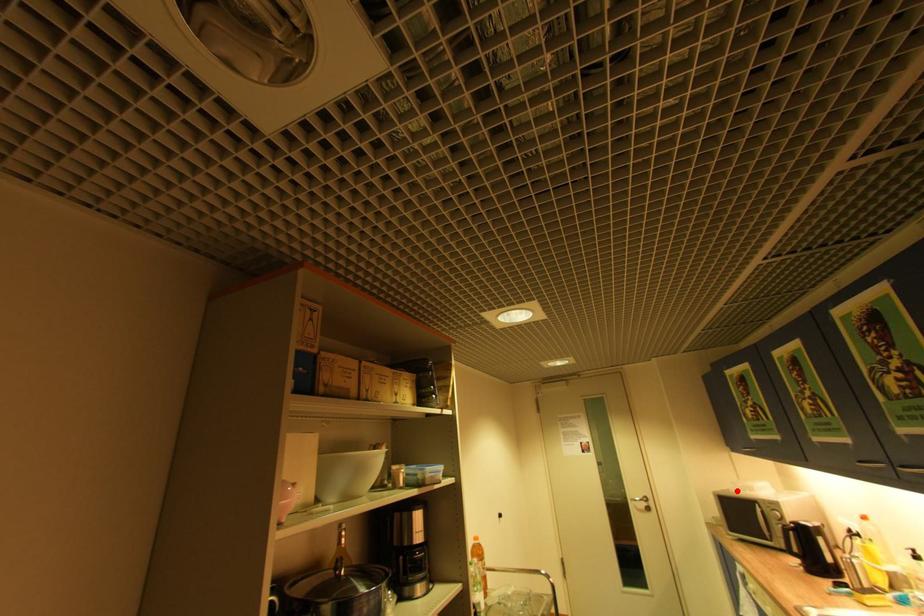
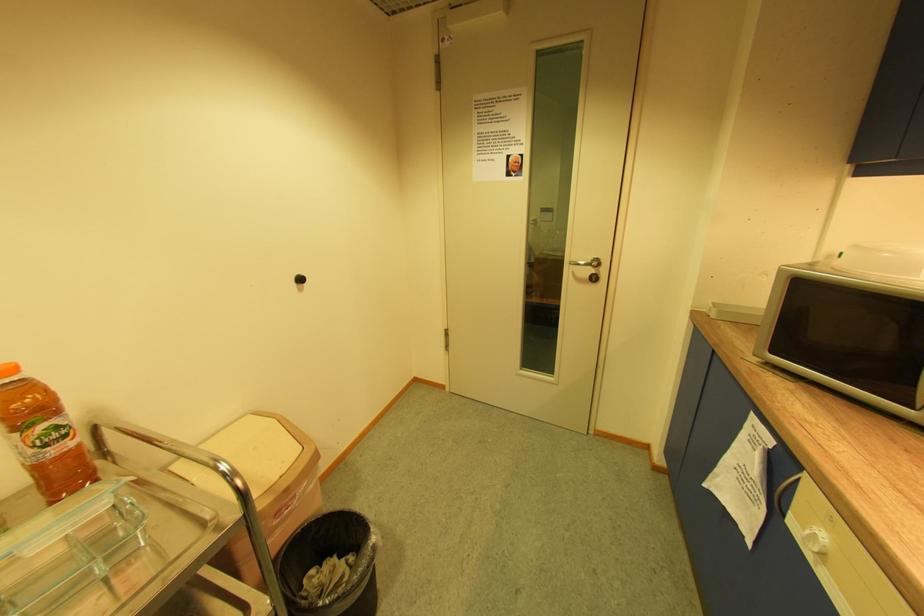
Locate, in the second image, the point that corresponds to the highlighted location in the first image.

(845, 265)